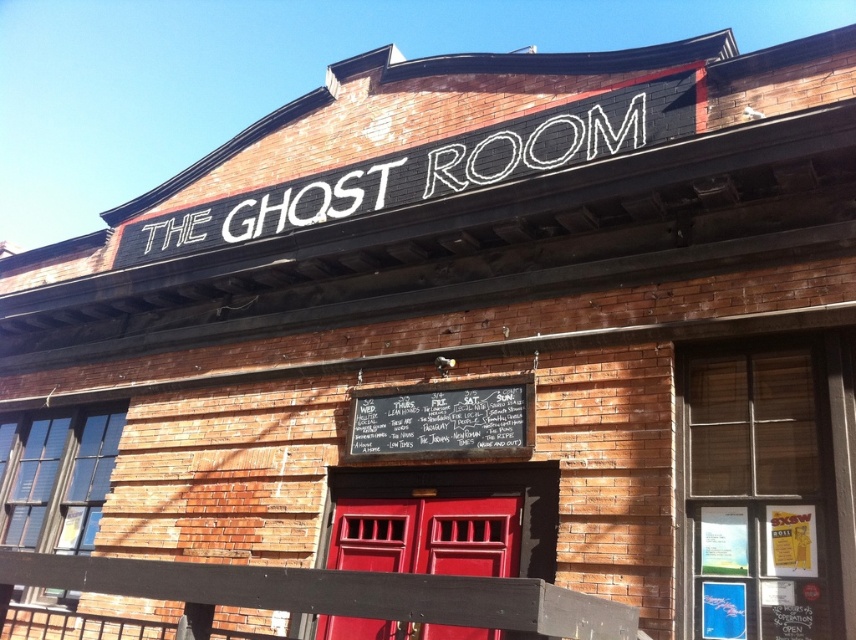
Between matte wood door at center and black chalkboard at center, which one appears on the left side from the viewer's perspective?

Positioned to the left is matte wood door at center.

Does point (378, 502) come farther from viewer compared to point (510, 428)?

Yes, it is behind point (510, 428).

What are the coordinates of `matte wood door at center` in the screenshot? It's located at (426, 536).